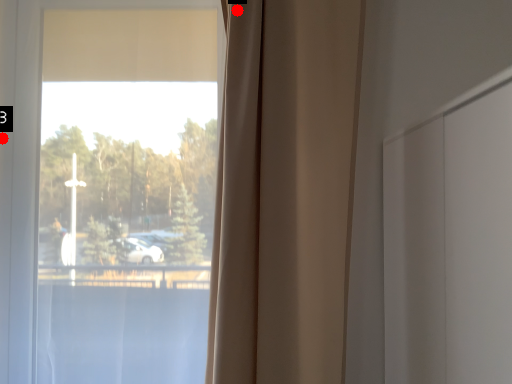
Question: Two points are circled on the image, labeled by A and B beside each circle. Which point is closer to the camera taking this photo?

Choices:
 (A) A is closer
 (B) B is closer

Answer: (A)